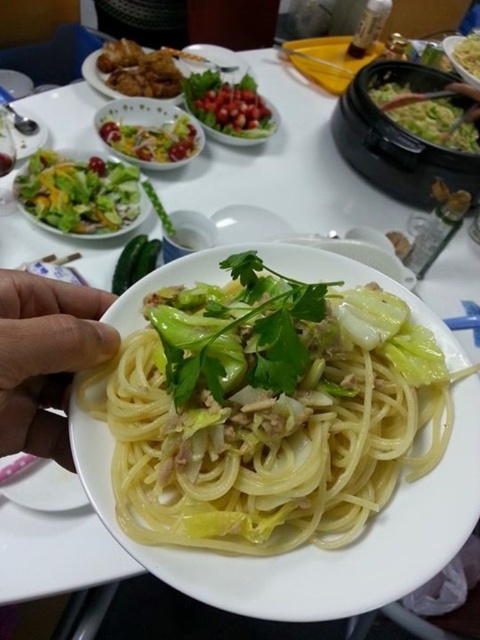
Which is above, green leafy vegetable at upper right or green smooth skin at center?

green leafy vegetable at upper right is higher up.

From the picture: Is green leafy vegetable at upper right positioned behind green smooth skin at center?

That is True.

Between point (380, 97) and point (135, 256), which one is positioned behind?

The point (380, 97) is more distant.

Find the location of a particular element. The height and width of the screenshot is (640, 480). green leafy vegetable at upper right is located at coordinates (429, 115).

Is point (196, 116) behind point (171, 124)?

Yes, it is.

Who is shorter, green leafy vegetable at upper center or shiny green salad at upper left?

With less height is shiny green salad at upper left.

Image resolution: width=480 pixels, height=640 pixels. I want to click on green leafy vegetable at upper center, so click(x=228, y=104).

Does point (342, 470) come farther from viewer compared to point (132, 140)?

No, (342, 470) is in front of (132, 140).

Does point (253, 477) come closer to viewer compared to point (142, 134)?

Yes, it is in front of point (142, 134).

Identify the location of white glossy pasta at center. This screenshot has width=480, height=640. (264, 422).